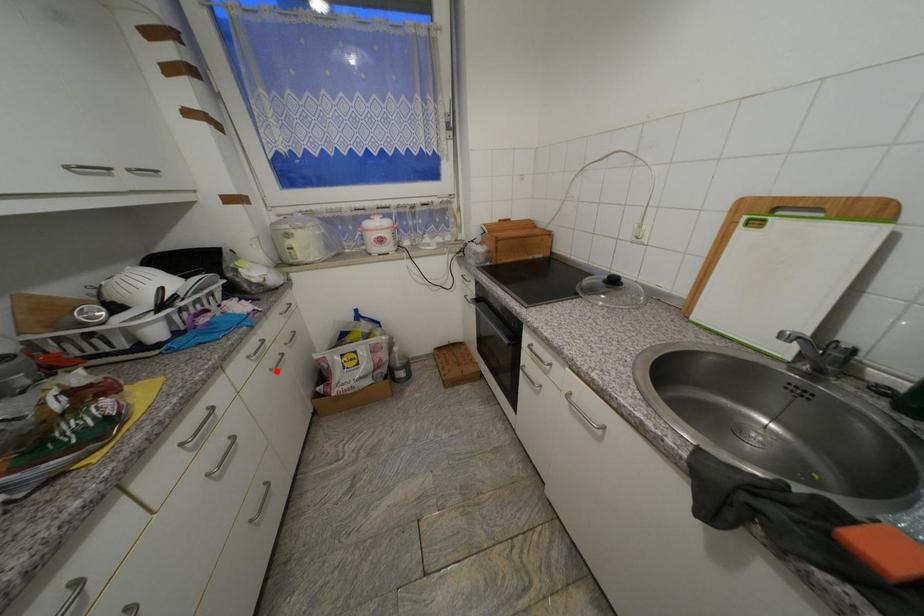
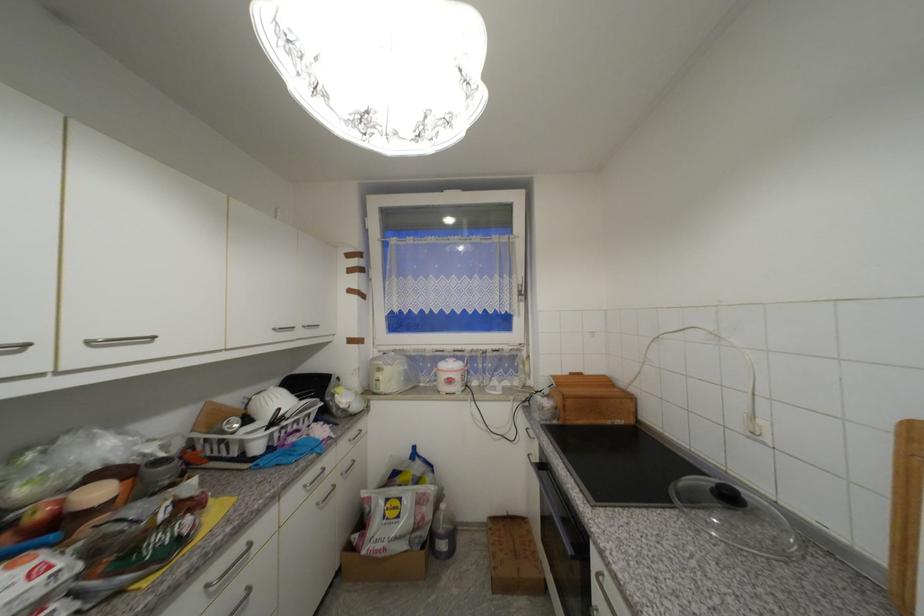
Where in the second image is the point corresponding to the highlighted location from the first image?

(322, 505)